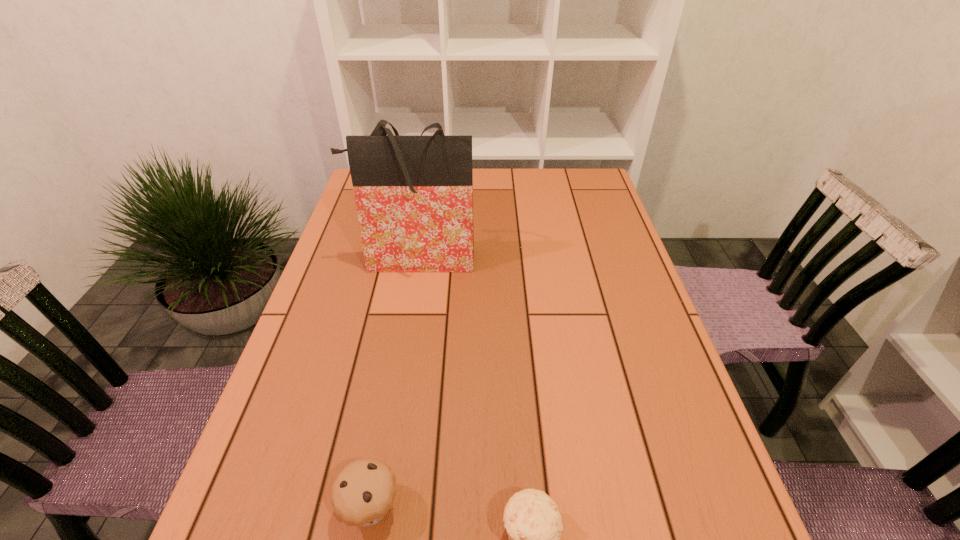
Where is `the tallest object`? the tallest object is located at coordinates (414, 194).

This screenshot has width=960, height=540. I want to click on shopping bag, so click(414, 194).

The height and width of the screenshot is (540, 960). I want to click on free point located on the front side of the shopping bag, so click(x=397, y=362).

At what (x,y) coordinates should I click in order to perform the action: click on object located at the left edge. Please return your answer as a coordinate pair (x, y). The image size is (960, 540). Looking at the image, I should click on (414, 194).

The width and height of the screenshot is (960, 540). I want to click on free spot at the far edge of the desktop, so click(475, 202).

This screenshot has width=960, height=540. I want to click on free space at the left edge of the desktop, so click(x=327, y=327).

The width and height of the screenshot is (960, 540). What are the coordinates of `vacant region at the right edge of the desktop` in the screenshot? It's located at (590, 232).

Locate an element on the screen. The height and width of the screenshot is (540, 960). vacant space at the far right corner of the desktop is located at coordinates (575, 182).

Choose which object is the nearest neighbor to the right muffin. Please provide its 2D coordinates. Your answer should be formatted as a tuple, i.e. [(x, y)], where the tuple contains the x and y coordinates of a point satisfying the conditions above.

[(363, 492)]

Locate an element on the screen. This screenshot has height=540, width=960. object that can be found as the closest to the shopping bag is located at coordinates (x=363, y=492).